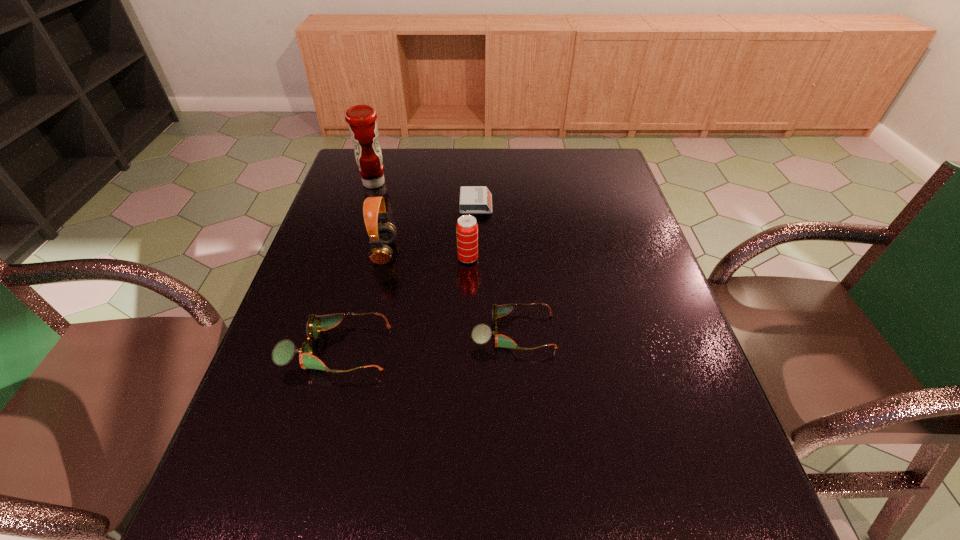
I want to click on vacant space that's between the alarm clock and the farthest object, so click(425, 194).

Identify the location of free space between the left spectacles and the farthest object. (355, 266).

Locate an element on the screen. vacant space that's between the condiment and the taller spectacles is located at coordinates pyautogui.click(x=355, y=266).

Locate an element on the screen. This screenshot has height=540, width=960. vacant area that lies between the second tallest object and the left spectacles is located at coordinates (361, 300).

Where is `blank region between the farthest object and the fourth shortest object`? blank region between the farthest object and the fourth shortest object is located at coordinates (420, 221).

At what (x,y) coordinates should I click in order to perform the action: click on object that ranks as the second closest to the left spectacles. Please return your answer as a coordinate pair (x, y). Looking at the image, I should click on (481, 334).

You are a GUI agent. You are given a task and a screenshot of the screen. Output one action in this format:
    pyautogui.click(x=<x>, y=<y>)
    Task: Click on the object that can be found as the fifth closest to the condiment
    
    Given the screenshot: What is the action you would take?
    pyautogui.click(x=481, y=334)

I want to click on free spot that satisfies the following two spatial constraints: 1. on the ear cups of the second tallest object; 2. on the right side of the soda can, so click(383, 258).